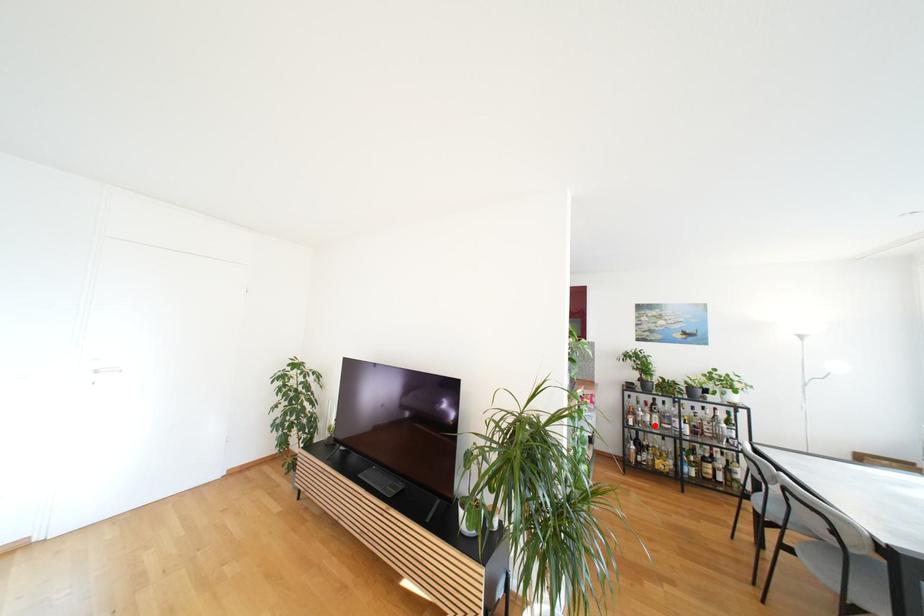
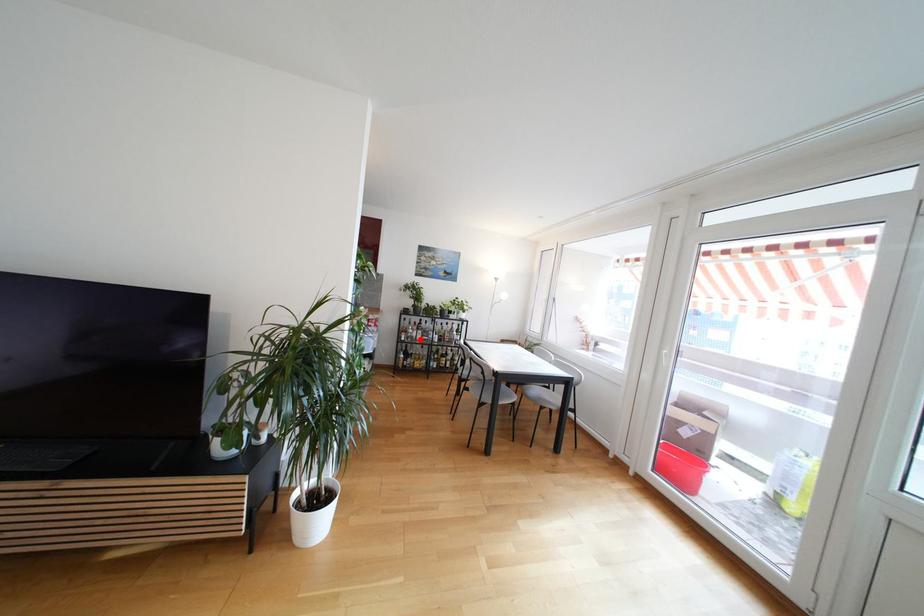
I am providing you with two images of the same scene from different viewpoints. A red point is marked on the first image and another point is marked on the second image. Do the highlighted points in image1 and image2 indicate the same real-world spot?

Yes